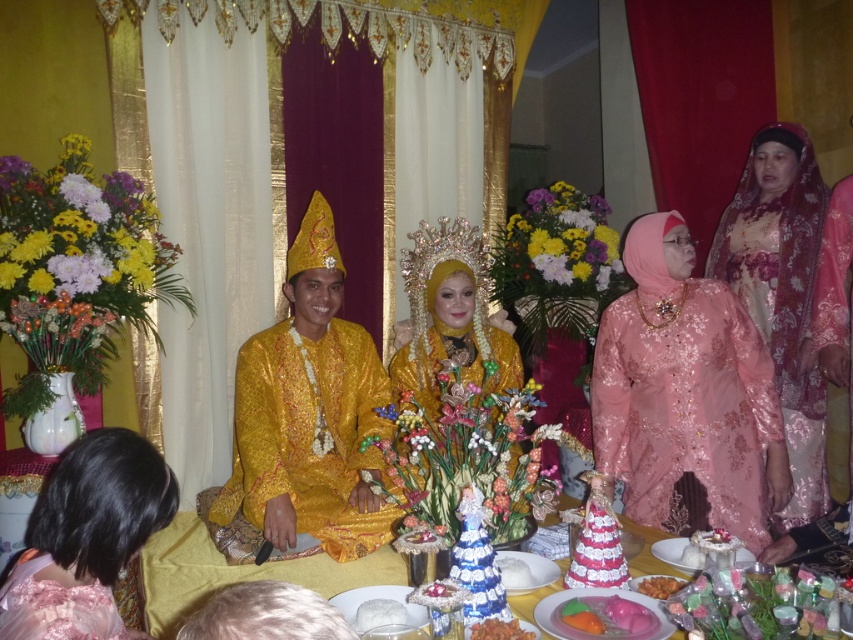
Question: Considering the relative positions of shiny gold robe at center and smooth wooden table at center in the image provided, where is shiny gold robe at center located with respect to smooth wooden table at center?

Choices:
 (A) left
 (B) right

Answer: (B)

Question: Considering the real-world distances, which object is closest to the pink satin dress at right?

Choices:
 (A) black satin dress at lower left
 (B) shiny gold robe at center
 (C) smooth pink candy at center
 (D) orange glazed pastry at center

Answer: (D)

Question: Is smooth pink candy at center below white rice at lower center?

Choices:
 (A) no
 (B) yes

Answer: (A)

Question: Is smooth wooden table at center positioned before pink glossy candy at center?

Choices:
 (A) yes
 (B) no

Answer: (B)

Question: Based on their relative distances, which object is nearer to the black satin dress at lower left?

Choices:
 (A) pink satin dress at right
 (B) pink lace dress at right

Answer: (B)

Question: Which point is closer to the camera?

Choices:
 (A) (392, 602)
 (B) (758, 288)
 (C) (596, 401)
 (D) (241, 372)

Answer: (A)